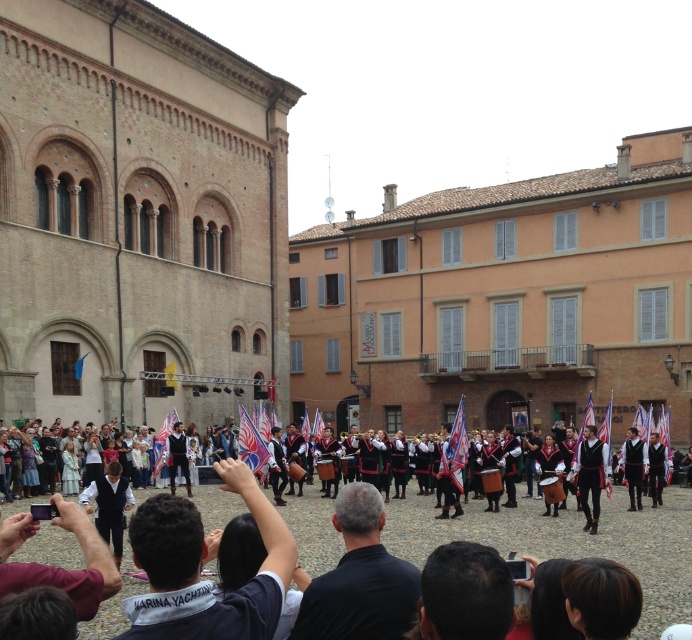
From the picture: You are a photographer trying to capture the entire group of performers in your shot. You notice the brick wall at center and the dark brown hair at center in the frame. Which object should you focus on to ensure the performers are centered and the brick wall is visible?

The brick wall at center is larger in size than the dark brown hair at center, so focusing on the brick wall at center will help center the performers and ensure the wall is visible in the shot.

You are standing in the historical square and want to take a photo of both the brick wall at center and the maroon fabric shirt at lower left. Which object should you position to your left side in the camera frame to capture both in the shot?

To capture both the brick wall at center and the maroon fabric shirt at lower left in the photo, position the maroon fabric shirt at lower left to your left side in the camera frame. This is because the brick wall at center is already to the left of the maroon fabric shirt at lower left, so aligning the shirt to the left in the frame will naturally include the wall on its left side as well.

You are a photographer trying to capture the entire scene of the historical square. You notice the brick wall at center and the maroon fabric shirt at lower left. Which object is located higher in the image?

The brick wall at center is positioned over the maroon fabric shirt at lower left, meaning it is higher in the image.